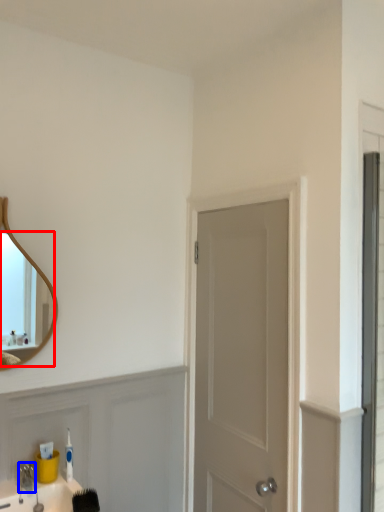
Question: Among these objects, which one is nearest to the camera, mirror (highlighted by a red box) or faucet (highlighted by a blue box)?

Choices:
 (A) mirror
 (B) faucet

Answer: (B)